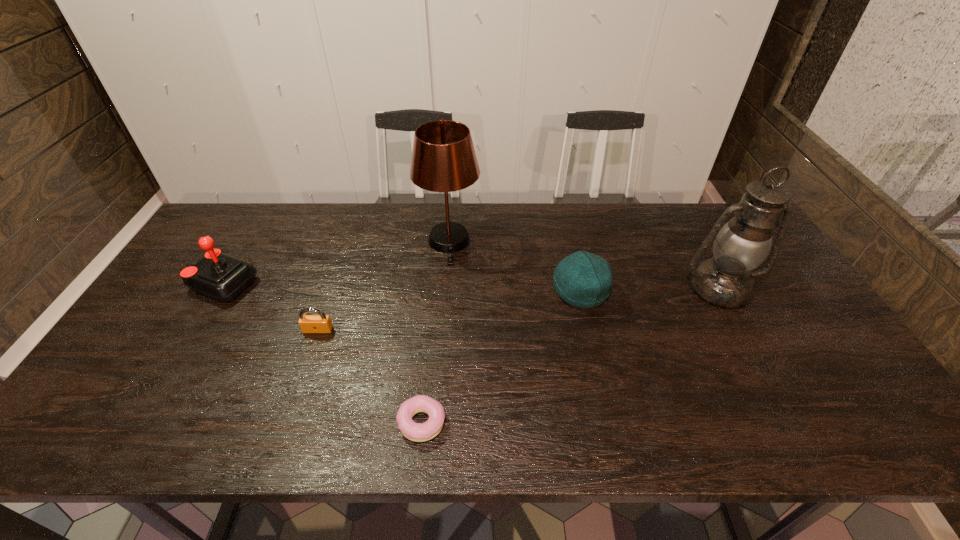
Locate an element on the screen. Image resolution: width=960 pixels, height=540 pixels. free point located on the front-facing side of the lampshade is located at coordinates (439, 365).

The image size is (960, 540). In order to click on vacant space situated 0.340m on the left of the oil lamp in this screenshot , I will do `click(564, 288)`.

Where is `vacant point located on the front of the joystick`? vacant point located on the front of the joystick is located at coordinates (129, 438).

Locate an element on the screen. This screenshot has height=540, width=960. free space located 0.300m on the left of the third shortest object is located at coordinates (450, 291).

Identify the location of vacant space located to unlock the padlock from the front. (308, 359).

Where is `free space located on the left of the nearest object`? The height and width of the screenshot is (540, 960). free space located on the left of the nearest object is located at coordinates (310, 422).

You are a GUI agent. You are given a task and a screenshot of the screen. Output one action in this format:
    pyautogui.click(x=<x>, y=<y>)
    Task: Click on the object at the far edge
    The image size is (960, 540).
    Given the screenshot: What is the action you would take?
    pyautogui.click(x=443, y=159)

Identify the location of object located at the near edge. The image size is (960, 540). (418, 432).

You are a GUI agent. You are given a task and a screenshot of the screen. Output one action in this format:
    pyautogui.click(x=<x>, y=<y>)
    Task: Click on the object located at the left edge
    
    Given the screenshot: What is the action you would take?
    pyautogui.click(x=220, y=276)

Locate an element on the screen. The width and height of the screenshot is (960, 540). object that is at the right edge is located at coordinates (741, 245).